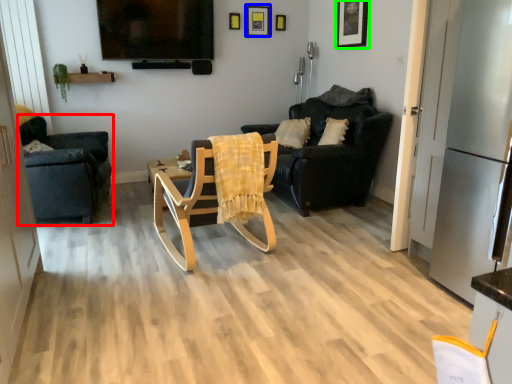
Question: Based on their relative distances, which object is farther from chair (highlighted by a red box)? Choose from picture frame (highlighted by a blue box) and picture frame (highlighted by a green box).

Choices:
 (A) picture frame
 (B) picture frame

Answer: (B)